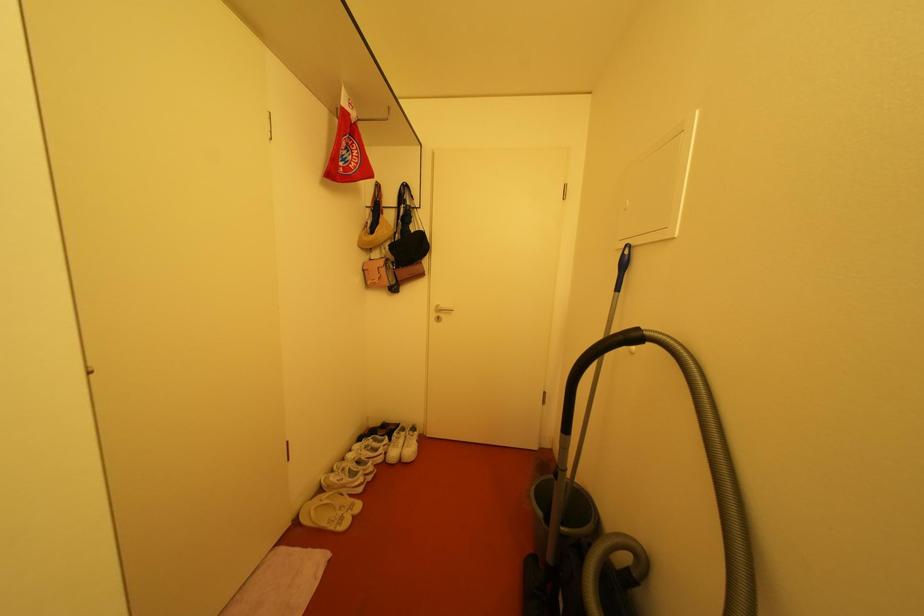
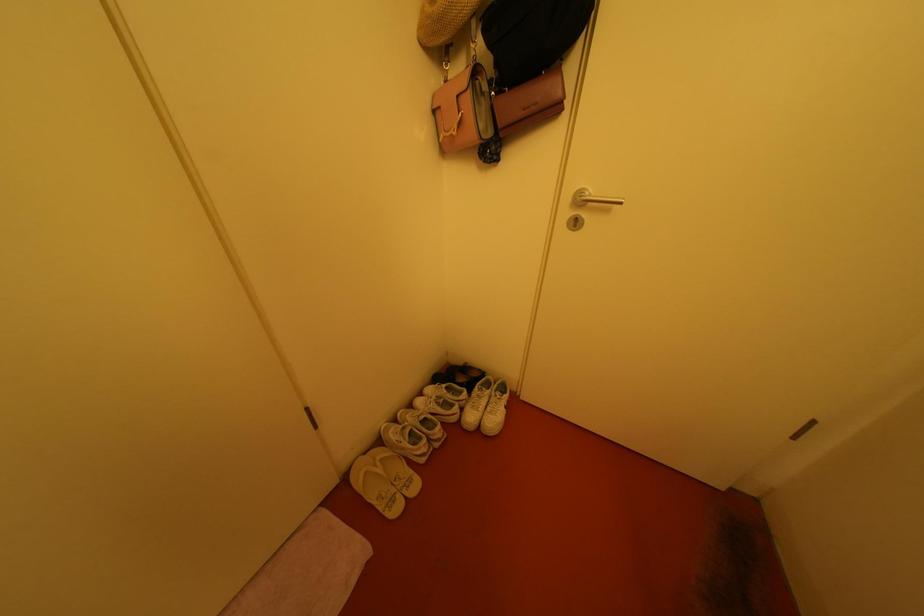
First-person continuous shooting, in which direction is the camera rotating?

The camera's rotation is toward left-down.